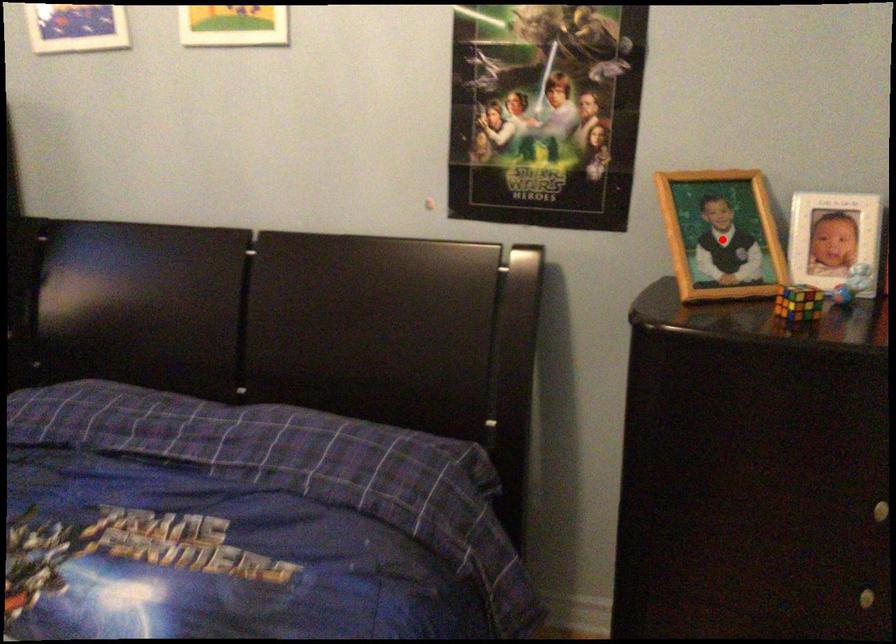
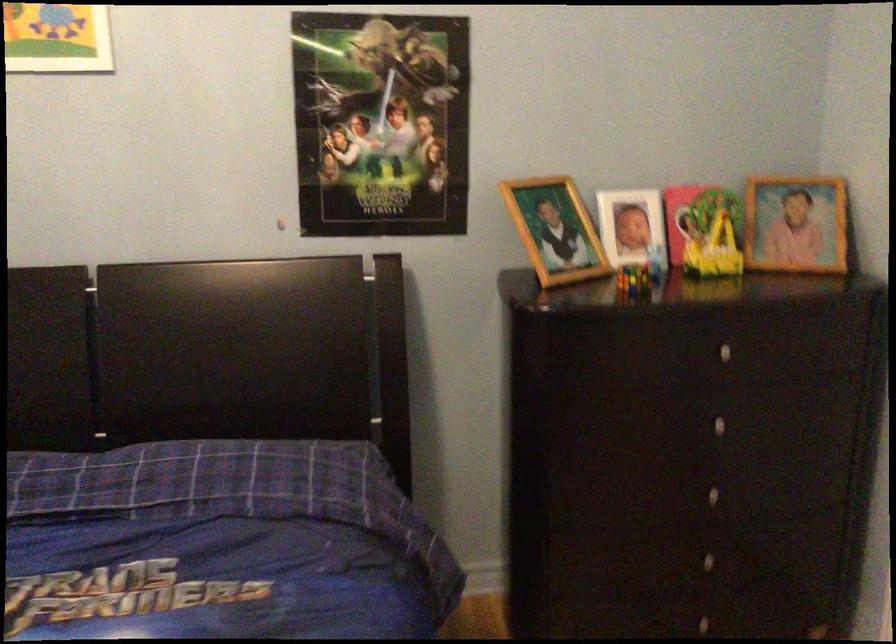
Question: A red point is marked in image1. In image2, is the corresponding 3D point closer to the camera or farther? Reply with the corresponding letter.

Choices:
 (A) The corresponding 3D point is closer.
 (B) The corresponding 3D point is farther.

Answer: (B)